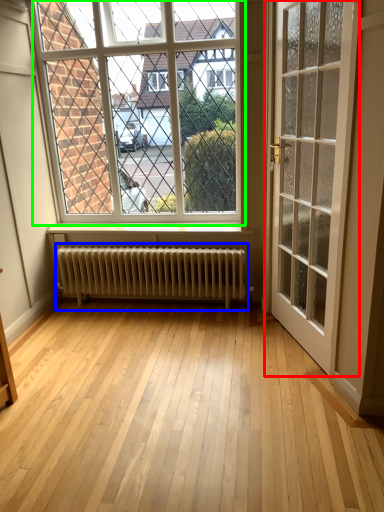
Question: Which is nearer to the door (highlighted by a red box)? radiator (highlighted by a blue box) or window (highlighted by a green box).

Choices:
 (A) radiator
 (B) window

Answer: (A)